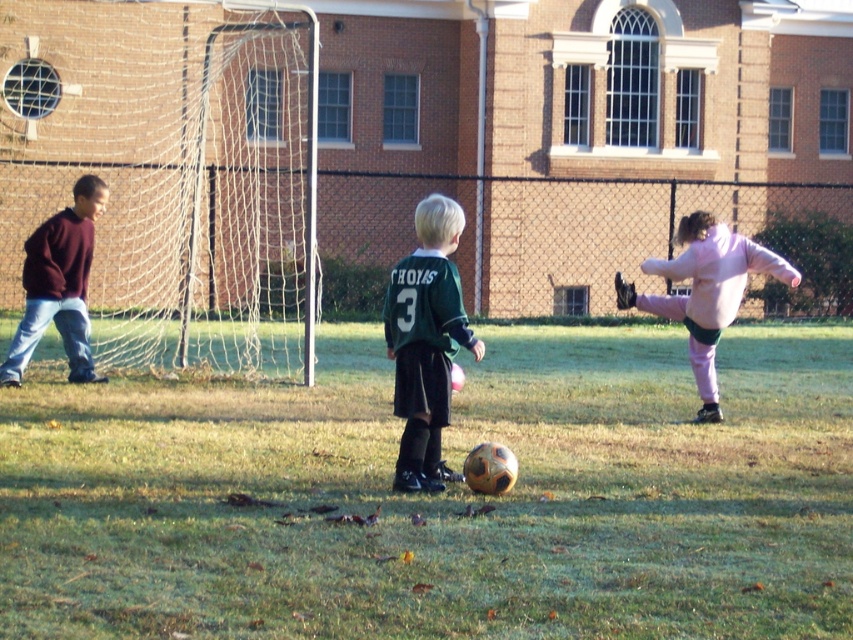
Is point (535, 497) less distant than point (457, 204)?

Yes.

Is orange textured ball at center closer to camera compared to green matte jersey at center?

Yes, it is in front of green matte jersey at center.

Where is `orange textured ball at center`? orange textured ball at center is located at coordinates (442, 497).

Can you confirm if orange textured ball at center is positioned above pink fleece jacket at right?

Actually, orange textured ball at center is below pink fleece jacket at right.

Can you confirm if orange textured ball at center is positioned to the left of pink fleece jacket at right?

Indeed, orange textured ball at center is positioned on the left side of pink fleece jacket at right.

I want to click on orange textured ball at center, so click(442, 497).

Image resolution: width=853 pixels, height=640 pixels. Identify the location of orange textured ball at center. (x=442, y=497).

How far apart are pink fleece jacket at right and maroon sweater at left?

pink fleece jacket at right is 5.39 meters away from maroon sweater at left.

Between point (631, 288) and point (62, 234), which one is positioned in front?

Point (62, 234) is more forward.

This screenshot has height=640, width=853. What are the coordinates of `pink fleece jacket at right` in the screenshot? It's located at (705, 291).